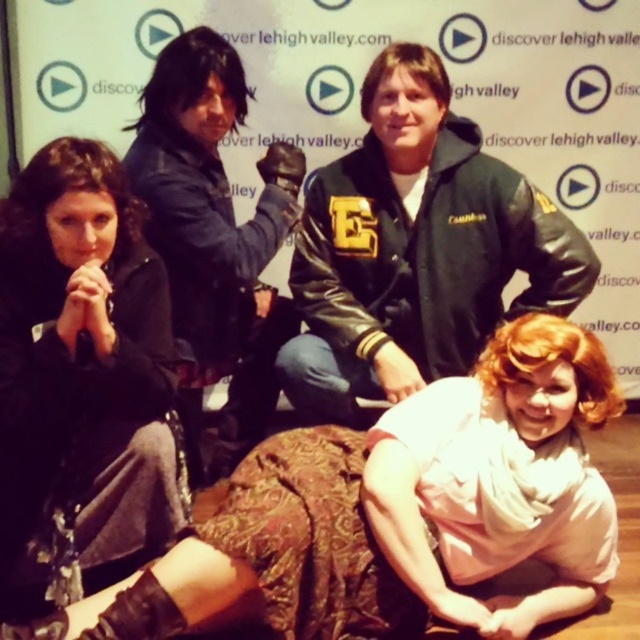
Is black leather jacket at center positioned at the back of black leather jacket at upper center?

Yes, black leather jacket at center is behind black leather jacket at upper center.

Where is `black leather jacket at center`? This screenshot has height=640, width=640. black leather jacket at center is located at coordinates (416, 250).

Which is behind, point (132, 220) or point (241, 90)?

The point (241, 90) is more distant.

Is black matte jacket at center above black leather jacket at upper center?

Incorrect, black matte jacket at center is not positioned above black leather jacket at upper center.

What do you see at coordinates (81, 380) in the screenshot? I see `black matte jacket at center` at bounding box center [81, 380].

The height and width of the screenshot is (640, 640). Identify the location of black matte jacket at center. (81, 380).

Is light pink fabric at lower right above black leather jacket at upper center?

Actually, light pink fabric at lower right is below black leather jacket at upper center.

Which is below, light pink fabric at lower right or black leather jacket at upper center?

Positioned lower is light pink fabric at lower right.

Is point (468, 532) positioned after point (195, 216)?

No, it is in front of (195, 216).

At what (x,y) coordinates should I click in order to perform the action: click on light pink fabric at lower right. Please return your answer as a coordinate pair (x, y). This screenshot has width=640, height=640. Looking at the image, I should click on [x=403, y=512].